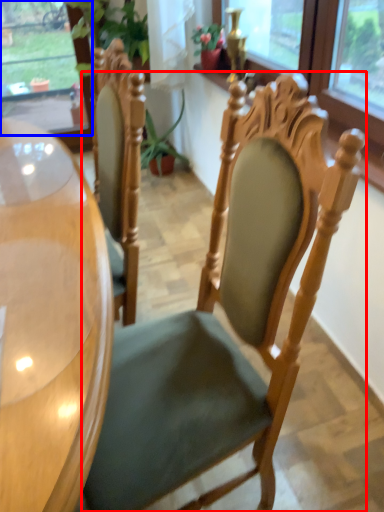
Question: Which object is closer to the camera taking this photo, chair (highlighted by a red box) or window (highlighted by a blue box)?

Choices:
 (A) chair
 (B) window

Answer: (A)